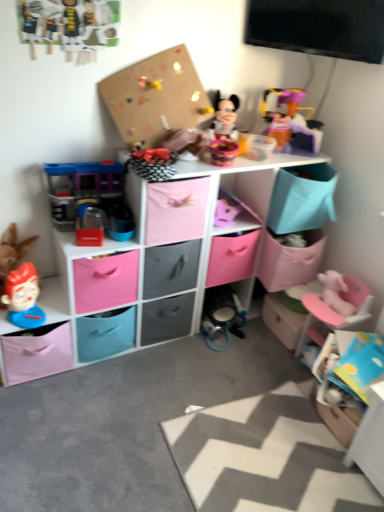
Question: Is translucent plastic toy at upper right, arranged as the third toy when ordered from the bottom, in front of pink plastic swivel chair at lower right?

Choices:
 (A) yes
 (B) no

Answer: (B)

Question: Considering the relative positions of translucent plastic toy at upper right, which is the 1th toy in right-to-left order, and pink plastic swivel chair at lower right in the image provided, is translucent plastic toy at upper right, which is the 1th toy in right-to-left order, to the left of pink plastic swivel chair at lower right from the viewer's perspective?

Choices:
 (A) yes
 (B) no

Answer: (A)

Question: Considering the relative positions of translucent plastic toy at upper right, which ranks as the third toy in left-to-right order, and pink plastic swivel chair at lower right in the image provided, is translucent plastic toy at upper right, which ranks as the third toy in left-to-right order, to the right of pink plastic swivel chair at lower right from the viewer's perspective?

Choices:
 (A) yes
 (B) no

Answer: (B)

Question: Could pink plastic swivel chair at lower right be considered to be inside translucent plastic toy at upper right, arranged as the third toy when ordered from the bottom?

Choices:
 (A) yes
 (B) no

Answer: (B)

Question: Does translucent plastic toy at upper right, arranged as the third toy when ordered from the bottom, have a smaller size compared to pink plastic swivel chair at lower right?

Choices:
 (A) no
 (B) yes

Answer: (B)

Question: From the image's perspective, is pink fabric storage cubes at center above or below smooth plastic toy head at lower left, the 1th toy when ordered from bottom to top?

Choices:
 (A) below
 (B) above

Answer: (B)

Question: Looking at their shapes, would you say pink fabric storage cubes at center is wider or thinner than smooth plastic toy head at lower left, the 1th toy when ordered from bottom to top?

Choices:
 (A) wide
 (B) thin

Answer: (A)

Question: Which is correct: pink fabric storage cubes at center is inside smooth plastic toy head at lower left, the first toy positioned from the left, or outside of it?

Choices:
 (A) inside
 (B) outside

Answer: (B)

Question: From a real-world perspective, is pink fabric storage cubes at center above or below smooth plastic toy head at lower left, the 1th toy when ordered from bottom to top?

Choices:
 (A) above
 (B) below

Answer: (A)

Question: In terms of height, does plastic playhouse at left, which is the 2th toy in left-to-right order, look taller or shorter compared to translucent plastic toy at upper right, arranged as the third toy when ordered from the bottom?

Choices:
 (A) short
 (B) tall

Answer: (A)

Question: Considering their positions, is plastic playhouse at left, which is the 2th toy in left-to-right order, located in front of or behind translucent plastic toy at upper right, arranged as the third toy when ordered from the bottom?

Choices:
 (A) front
 (B) behind

Answer: (A)

Question: From a real-world perspective, is plastic playhouse at left, the 2th toy in the top-to-bottom sequence, positioned above or below translucent plastic toy at upper right, which ranks as the third toy in left-to-right order?

Choices:
 (A) below
 (B) above

Answer: (A)

Question: Does point (122, 174) appear closer or farther from the camera than point (276, 114)?

Choices:
 (A) closer
 (B) farther

Answer: (A)

Question: In terms of size, does smooth plastic toy head at lower left, the 1th toy when ordered from bottom to top, appear bigger or smaller than pink plastic swivel chair at lower right?

Choices:
 (A) small
 (B) big

Answer: (A)

Question: From the image's perspective, is smooth plastic toy head at lower left, the 3th toy from the top, located above or below pink plastic swivel chair at lower right?

Choices:
 (A) below
 (B) above

Answer: (B)